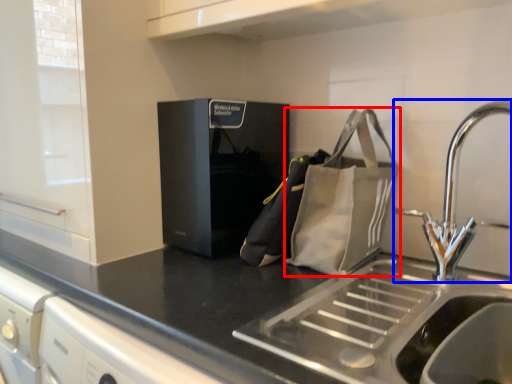
Question: Which object is further to the camera taking this photo, pouch (highlighted by a red box) or tap (highlighted by a blue box)?

Choices:
 (A) pouch
 (B) tap

Answer: (A)